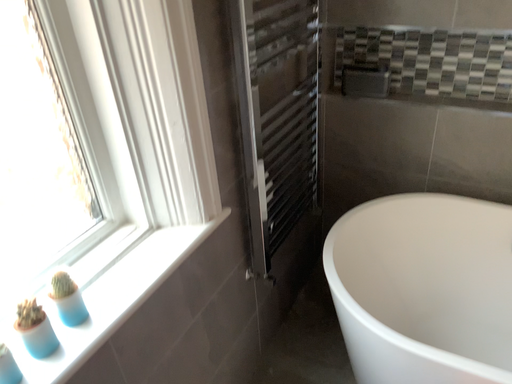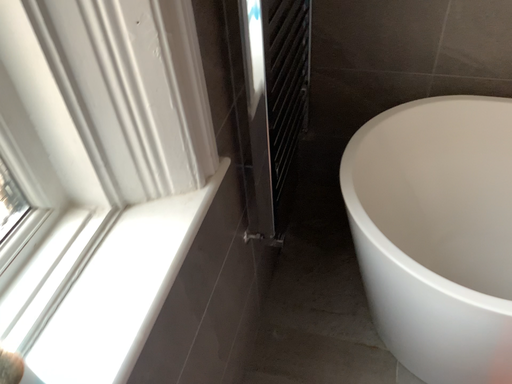
Question: How did the camera likely rotate when shooting the video?

Choices:
 (A) rotated upward
 (B) rotated downward

Answer: (B)